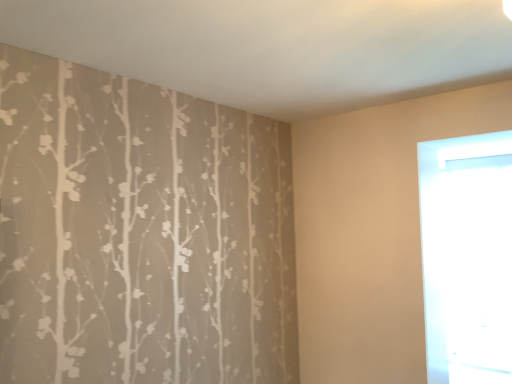
This screenshot has height=384, width=512. Describe the element at coordinates (467, 257) in the screenshot. I see `transparent glass door at right` at that location.

Locate an element on the screen. The height and width of the screenshot is (384, 512). transparent glass door at right is located at coordinates (467, 257).

In order to face transparent glass door at right, should I rotate leftwards or rightwards?

To face it directly, rotate right by 27.934 degrees.

This screenshot has height=384, width=512. Identify the location of transparent glass door at right. (467, 257).